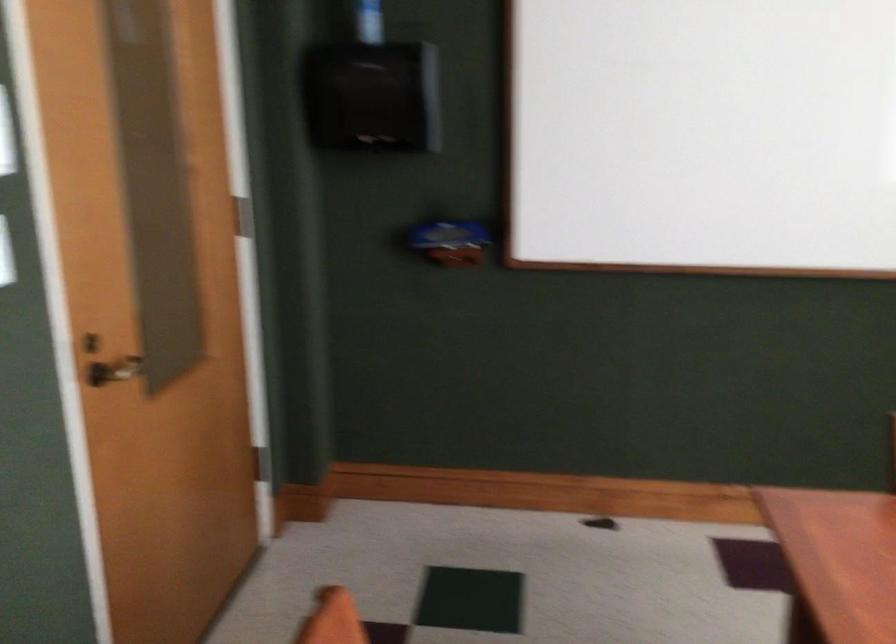
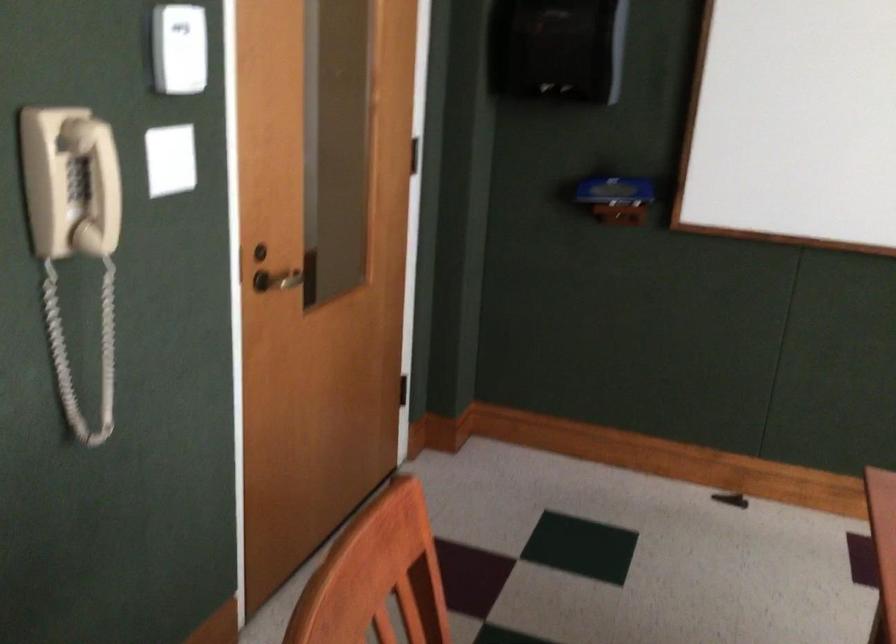
In a continuous first-person perspective shot, in which direction is the camera moving?

The cameraman walked toward right, backward.